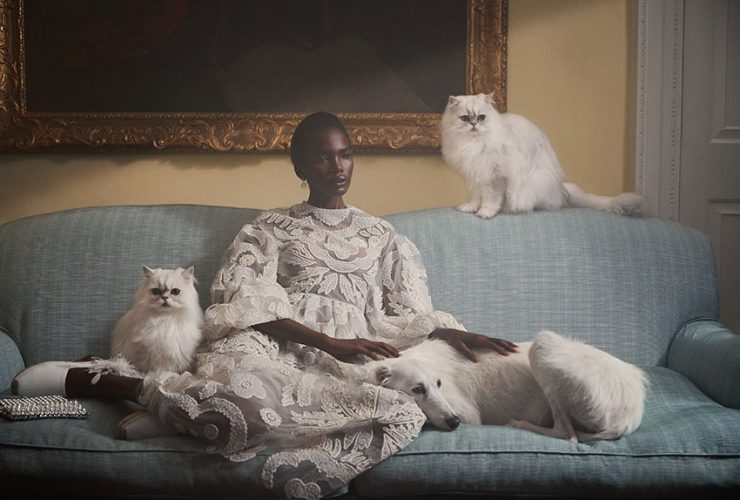
The width and height of the screenshot is (740, 500). Find the location of `white door`. white door is located at coordinates (x=703, y=120).